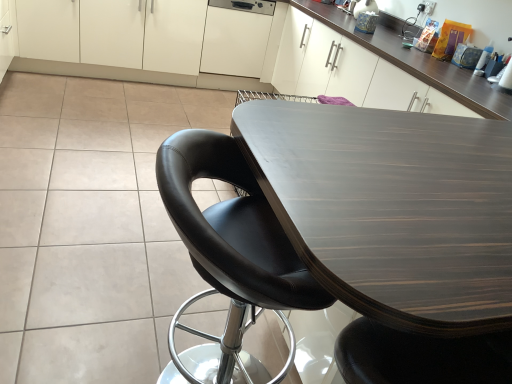
Question: From a real-world perspective, is white matte cabinet at center, which is counted as the second cabinetry, starting from the left, located beneath dark wood table at center?

Choices:
 (A) no
 (B) yes

Answer: (A)

Question: Is white matte cabinet at center, the 1th cabinetry when ordered from right to left, facing away from dark wood table at center?

Choices:
 (A) yes
 (B) no

Answer: (B)

Question: Is white matte cabinet at center, the 1th cabinetry when ordered from right to left, next to dark wood table at center?

Choices:
 (A) yes
 (B) no

Answer: (B)

Question: Is white matte cabinet at center, which is counted as the second cabinetry, starting from the left, at the right side of dark wood table at center?

Choices:
 (A) yes
 (B) no

Answer: (B)

Question: Does white matte cabinet at center, which is counted as the second cabinetry, starting from the left, have a lesser width compared to dark wood table at center?

Choices:
 (A) no
 (B) yes

Answer: (B)

Question: Based on their sizes in the image, would you say white matte cabinet at center, the 1th cabinetry when ordered from right to left, is bigger or smaller than dark wood table at center?

Choices:
 (A) small
 (B) big

Answer: (A)

Question: Visually, is white matte cabinet at center, the 1th cabinetry when ordered from right to left, positioned to the left or to the right of dark wood table at center?

Choices:
 (A) right
 (B) left

Answer: (B)

Question: In the image, is white matte cabinet at center, which is counted as the second cabinetry, starting from the left, positioned in front of or behind dark wood table at center?

Choices:
 (A) behind
 (B) front

Answer: (A)

Question: Is white matte cabinet at center, which is counted as the second cabinetry, starting from the left, situated inside dark wood table at center or outside?

Choices:
 (A) outside
 (B) inside

Answer: (A)

Question: From the image's perspective, is dark wood table at center located above or below white matte cabinet at center, the 1th cabinetry when ordered from right to left?

Choices:
 (A) below
 (B) above

Answer: (A)

Question: From a real-world perspective, is dark wood table at center physically located above or below white matte cabinet at center, which is counted as the second cabinetry, starting from the left?

Choices:
 (A) below
 (B) above

Answer: (A)

Question: Is point (x=489, y=198) closer or farther from the camera than point (x=261, y=31)?

Choices:
 (A) farther
 (B) closer

Answer: (B)

Question: Is dark wood table at center inside or outside of white matte cabinet at center, the 1th cabinetry when ordered from right to left?

Choices:
 (A) inside
 (B) outside

Answer: (B)

Question: From a real-world perspective, relative to dark wood table at center, is black leather chair at center vertically above or below?

Choices:
 (A) above
 (B) below

Answer: (A)

Question: Is black leather chair at center in front of or behind dark wood table at center in the image?

Choices:
 (A) front
 (B) behind

Answer: (B)